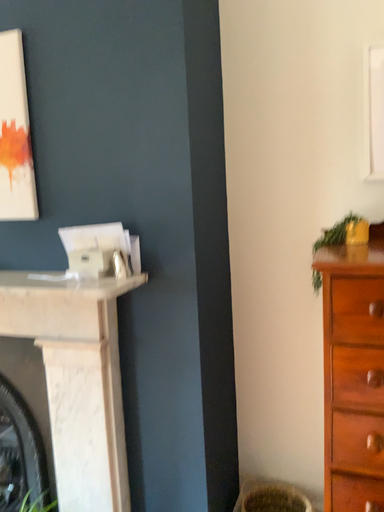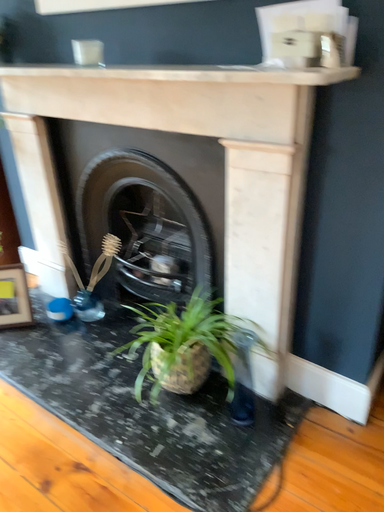
Question: Which way did the camera rotate in the video?

Choices:
 (A) rotated downward
 (B) rotated upward

Answer: (A)